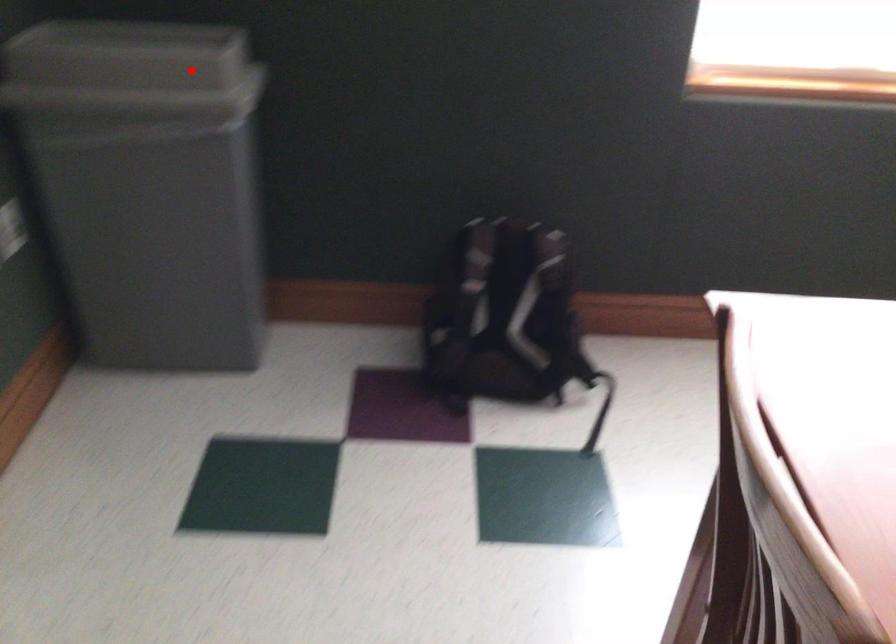
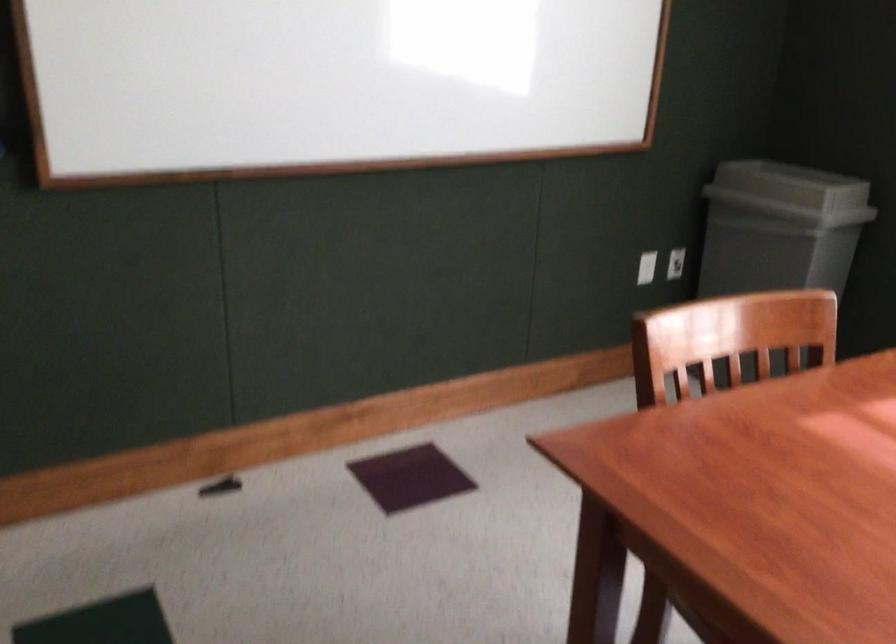
Question: I am providing you with two images of the same scene from different viewpoints. Given a red point in image1, look at the same physical point in image2. Is it:

Choices:
 (A) Closer to the viewpoint
 (B) Farther from the viewpoint

Answer: (B)